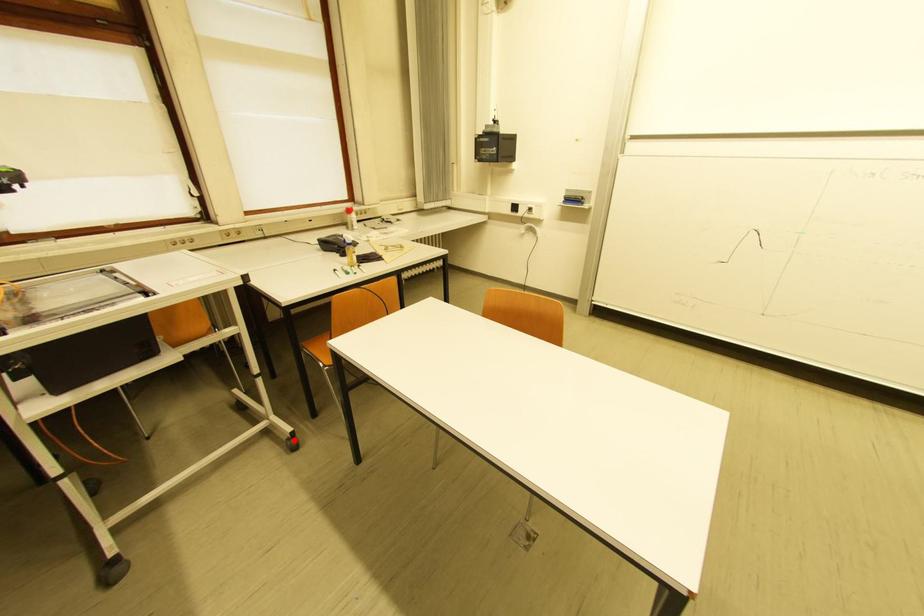
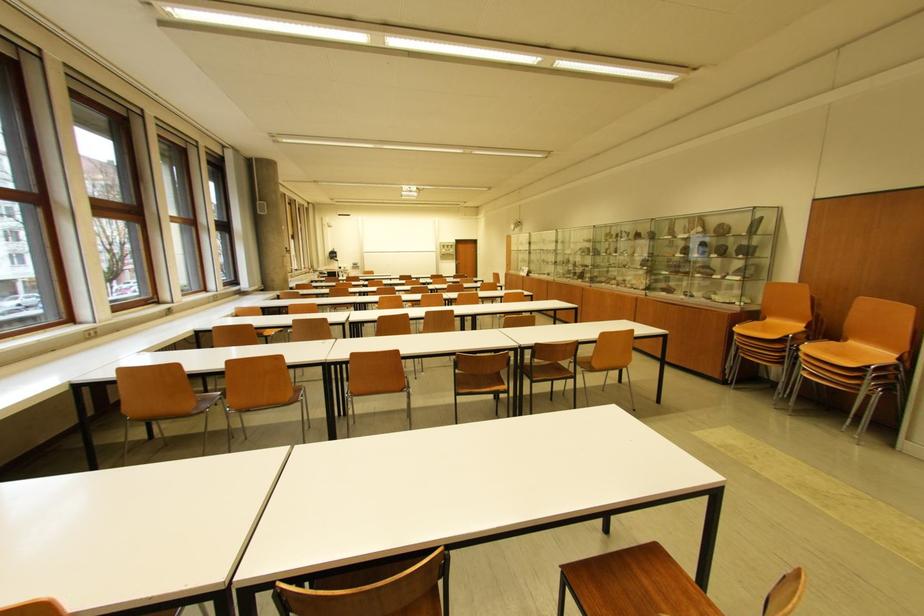
Question: I am providing you with two images of the same scene from different viewpoints. A red point is marked on the first image. Can you still see the location of the red point in image 2?

Choices:
 (A) Yes
 (B) No

Answer: (B)